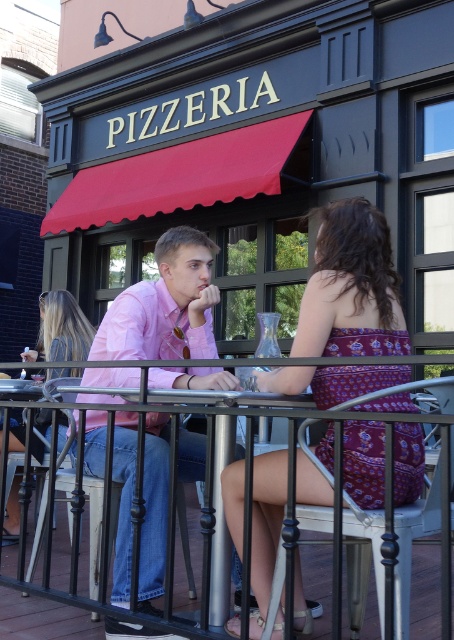
Question: Which point is closer to the camera?

Choices:
 (A) (187, 337)
 (B) (44, 593)

Answer: (B)

Question: Is pink cotton shirt at center smaller than blonde hair at center?

Choices:
 (A) no
 (B) yes

Answer: (A)

Question: Does pink cotton shirt at center have a greater width compared to black metal railing at center?

Choices:
 (A) yes
 (B) no

Answer: (B)

Question: Among these objects, which one is nearest to the camera?

Choices:
 (A) blonde hair at center
 (B) black metal railing at center
 (C) pink cotton shirt at center
 (D) printed fabric dress at center

Answer: (B)

Question: Which of the following is the farthest from the observer?

Choices:
 (A) pink cotton shirt at center
 (B) printed fabric dress at center
 (C) blonde hair at center
 (D) black metal railing at center

Answer: (C)

Question: Is pink cotton shirt at center above black metal railing at center?

Choices:
 (A) no
 (B) yes

Answer: (B)